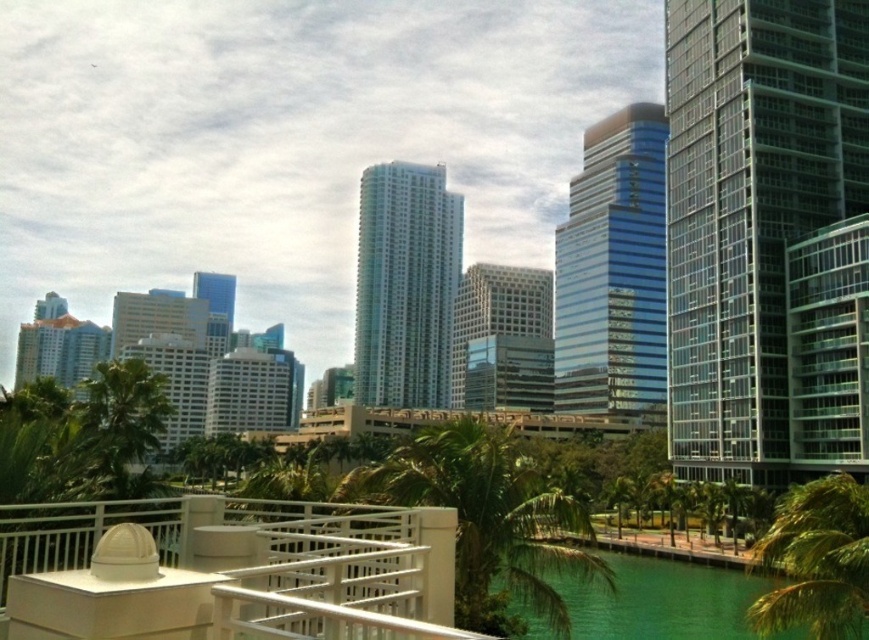
In the scene shown: Can you confirm if green leafy palm tree at center is wider than green leafy palm tree at lower right?

Incorrect, green leafy palm tree at center's width does not surpass green leafy palm tree at lower right's.

Locate an element on the screen. The image size is (869, 640). green leafy palm tree at center is located at coordinates (488, 520).

Where is `green leafy palm tree at center`? The width and height of the screenshot is (869, 640). green leafy palm tree at center is located at coordinates (488, 520).

The width and height of the screenshot is (869, 640). I want to click on green leafy palm tree at lower right, so click(x=814, y=561).

Looking at this image, which is below, green leafy palm tree at lower right or green leafy palm tree at lower left?

Positioned lower is green leafy palm tree at lower right.

Is point (806, 589) more distant than point (127, 396)?

No, (806, 589) is closer to viewer.

I want to click on green leafy palm tree at lower right, so click(x=814, y=561).

Is green leafy palm tree at center bigger than green leafy palm tree at lower left?

Correct, green leafy palm tree at center is larger in size than green leafy palm tree at lower left.

Which of these two, green leafy palm tree at center or green leafy palm tree at lower left, stands taller?

green leafy palm tree at center

Measure the distance between point (521, 557) and camera.

Point (521, 557) is 27.94 meters from camera.

Image resolution: width=869 pixels, height=640 pixels. I want to click on green leafy palm tree at center, so click(x=488, y=520).